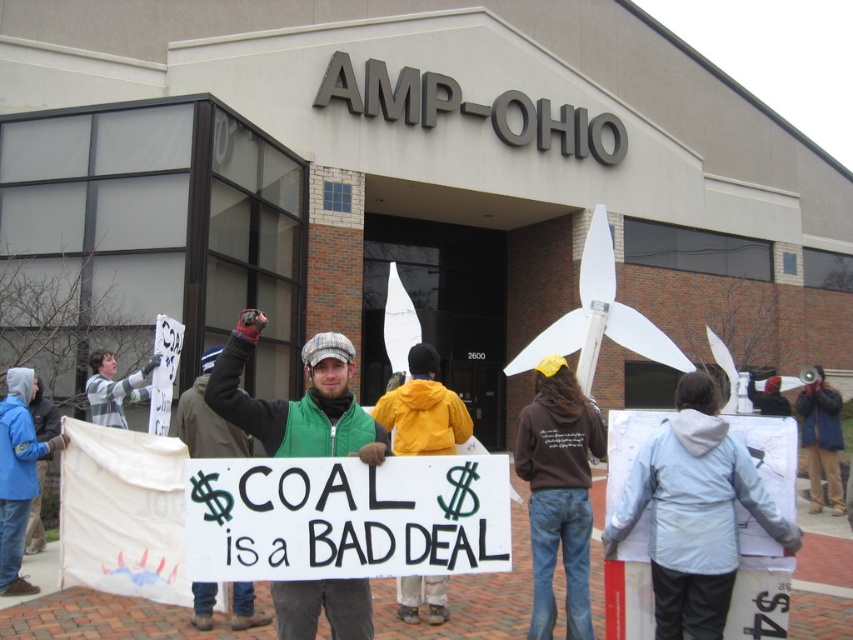
Can you confirm if dark blue jacket at center is wider than green fabric jacket at upper center?

Incorrect, dark blue jacket at center's width does not surpass green fabric jacket at upper center's.

Does point (816, 392) come behind point (100, 355)?

Yes, point (816, 392) is behind point (100, 355).

The image size is (853, 640). I want to click on dark blue jacket at center, so click(821, 440).

This screenshot has height=640, width=853. What do you see at coordinates (422, 410) in the screenshot?
I see `yellow jacket at center` at bounding box center [422, 410].

Can you confirm if yellow jacket at center is smaller than green fabric jacket at center?

Actually, yellow jacket at center might be larger than green fabric jacket at center.

Between point (432, 365) and point (209, 449), which one is positioned in front?

Point (209, 449) is more forward.

Identify the location of yellow jacket at center. The width and height of the screenshot is (853, 640). (422, 410).

Does point (757, 522) lie in front of point (0, 410)?

Yes, it is in front of point (0, 410).

Is light blue jacket at center wider than blue fleece jacket at lower left?

Yes, light blue jacket at center is wider than blue fleece jacket at lower left.

Locate an element on the screen. The image size is (853, 640). light blue jacket at center is located at coordinates (694, 513).

You are a GUI agent. You are given a task and a screenshot of the screen. Output one action in this format:
    pyautogui.click(x=<x>, y=<y>)
    Task: Click on the light blue jacket at center
    This screenshot has height=640, width=853.
    Given the screenshot: What is the action you would take?
    pyautogui.click(x=694, y=513)